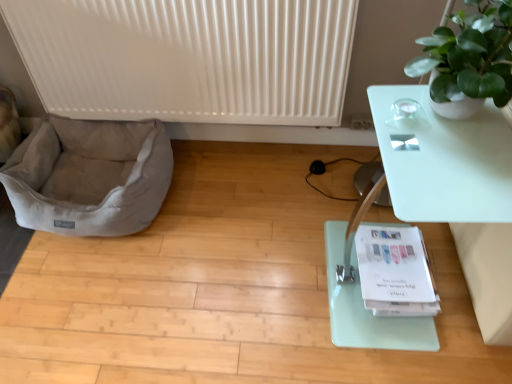
Image resolution: width=512 pixels, height=384 pixels. Find the location of `free space between white paper yoga mat at lower center and light gray fabric dog bed at lower left`. free space between white paper yoga mat at lower center and light gray fabric dog bed at lower left is located at coordinates (228, 231).